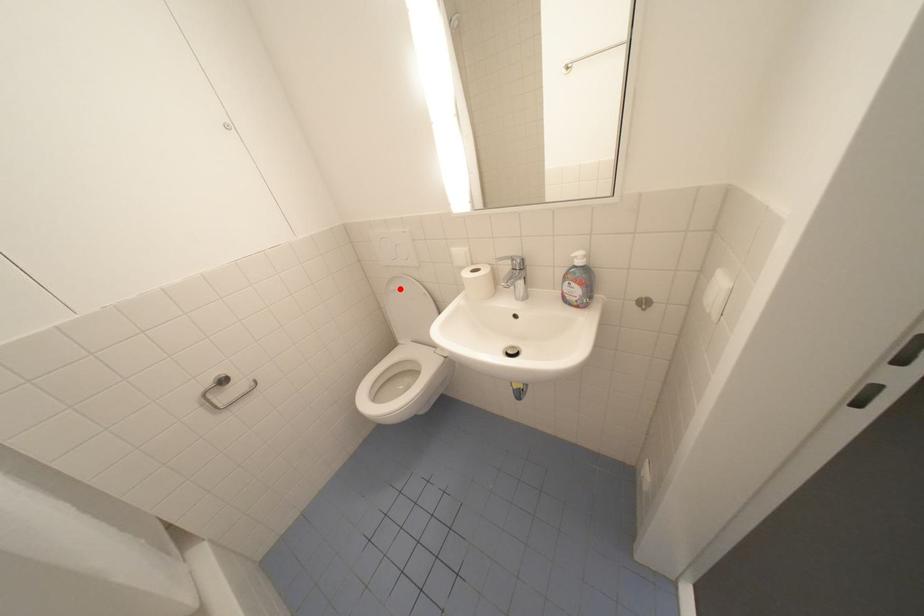
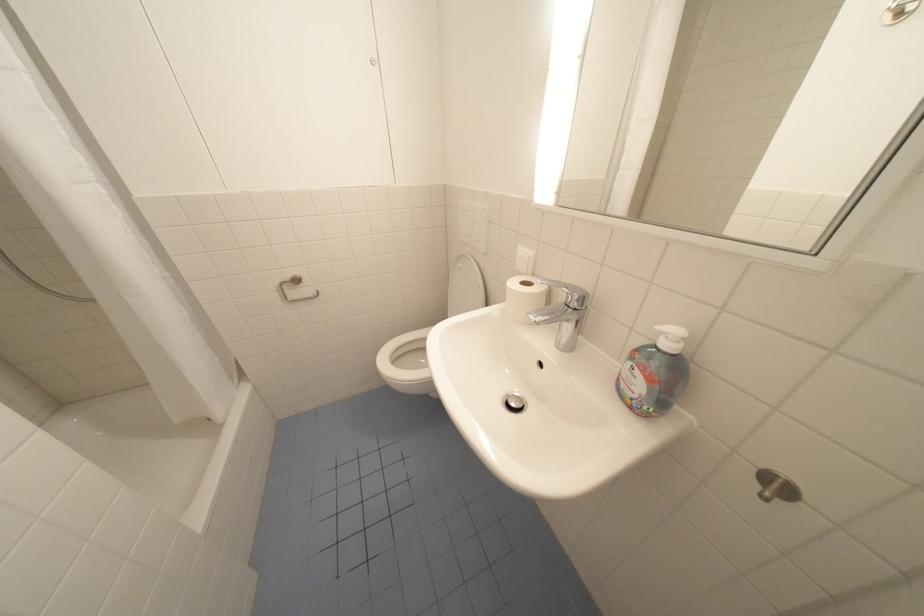
Where in the second image is the point corresponding to the highlighted location from the first image?

(468, 265)